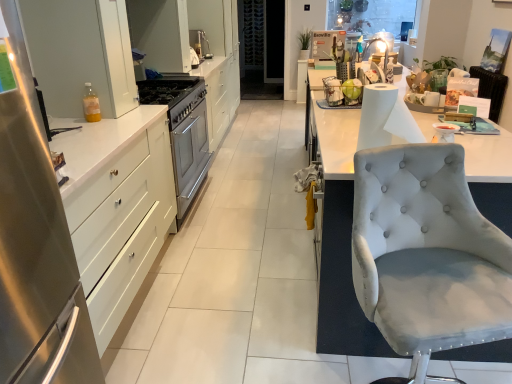
Question: Could you tell me if translucent plastic bottle at left is facing satin silver sink at center?

Choices:
 (A) yes
 (B) no

Answer: (B)

Question: Is translucent plastic bottle at left oriented away from satin silver sink at center?

Choices:
 (A) yes
 (B) no

Answer: (B)

Question: Is translucent plastic bottle at left further to the viewer compared to satin silver sink at center?

Choices:
 (A) yes
 (B) no

Answer: (B)

Question: Considering the relative sizes of translucent plastic bottle at left and satin silver sink at center in the image provided, is translucent plastic bottle at left taller than satin silver sink at center?

Choices:
 (A) yes
 (B) no

Answer: (B)

Question: Can you confirm if translucent plastic bottle at left is positioned to the left of satin silver sink at center?

Choices:
 (A) no
 (B) yes

Answer: (B)

Question: From a real-world perspective, is translucent plastic bottle at left under satin silver sink at center?

Choices:
 (A) yes
 (B) no

Answer: (B)

Question: Is white paper at right to the left of white glossy cabinet at upper left, which is the 3th cabinetry from bottom to top, from the viewer's perspective?

Choices:
 (A) yes
 (B) no

Answer: (B)

Question: From the image's perspective, is white paper at right over white glossy cabinet at upper left, the 3th cabinetry when ordered from front to back?

Choices:
 (A) yes
 (B) no

Answer: (B)

Question: Considering the relative sizes of white paper at right and white glossy cabinet at upper left, the 3th cabinetry when ordered from front to back, in the image provided, is white paper at right thinner than white glossy cabinet at upper left, the 3th cabinetry when ordered from front to back,?

Choices:
 (A) no
 (B) yes

Answer: (B)

Question: Is white paper at right positioned behind white glossy cabinet at upper left, the 1th cabinetry in the back-to-front sequence?

Choices:
 (A) no
 (B) yes

Answer: (A)

Question: Can you confirm if white paper at right is smaller than white glossy cabinet at upper left, the 3th cabinetry when ordered from front to back?

Choices:
 (A) no
 (B) yes

Answer: (B)

Question: Does white paper at right have a greater width compared to white glossy cabinet at upper left, the 1th cabinetry in the back-to-front sequence?

Choices:
 (A) no
 (B) yes

Answer: (A)

Question: Is light gray fabric chair at right directly adjacent to satin silver sink at center?

Choices:
 (A) yes
 (B) no

Answer: (B)